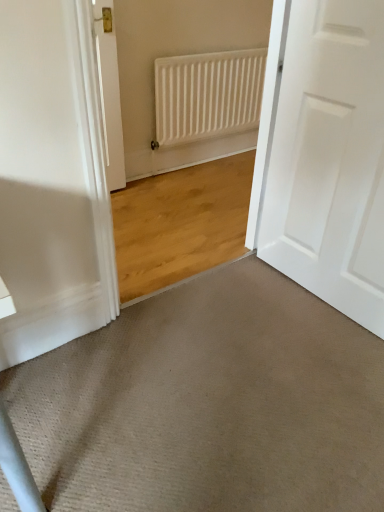
I want to click on vacant space that is to the left of white matte door at right, so click(239, 308).